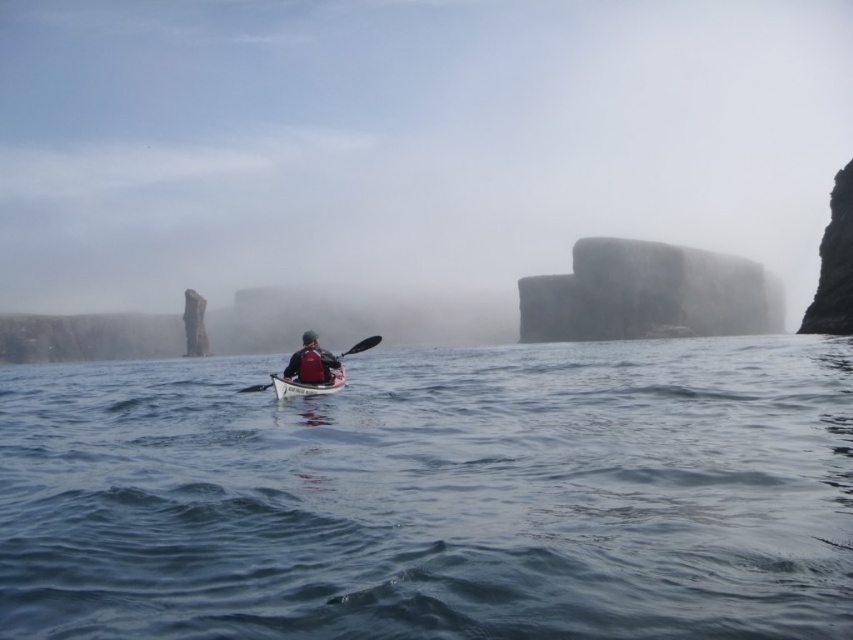
You are a drone operator trying to capture a photo of the blue water at center. The drone is currently hovering at point A, which is at coordinates 0.7, 0.5. The blue water at center is at point B, which is at coordinates (436,496). To get a clear shot, you need to adjust the drone to move directly towards the blue water at center. In which direction should you move the drone from point A to point B?

The blue water at center is located at point B with coordinates (436,496). The drone is at point A with coordinates 0.7, 0.5. To move towards the blue water at center, the drone should move northeast because the x and y coordinates of point B are both higher than those of point A.

You are a photographer trying to capture the matte white canoe at center and the black plastic paddle at center in a single shot. Which object should you position closer to the left side of your camera frame to ensure both are visible?

You should position the black plastic paddle at center closer to the left side of your camera frame because the matte white canoe at center is to the right of the black plastic paddle at center.

You are a photographer trying to capture the matte white canoe at center and the foggy stone formation at center in a single shot. Based on the scene, which object appears wider in the image?

The foggy stone formation at center appears wider in the image as its width is larger than the matte white canoe at center.